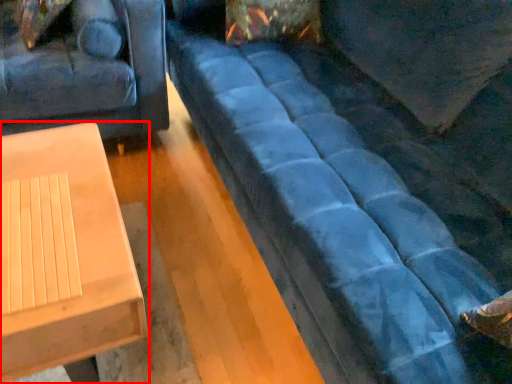
Question: Observing the image, what is the correct spatial positioning of table (annotated by the red box) in reference to studio couch?

Choices:
 (A) left
 (B) right

Answer: (A)